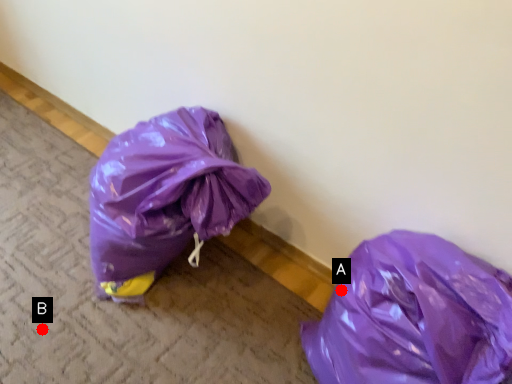
Question: Two points are circled on the image, labeled by A and B beside each circle. Among these points, which one is nearest to the camera?

Choices:
 (A) A is closer
 (B) B is closer

Answer: (A)